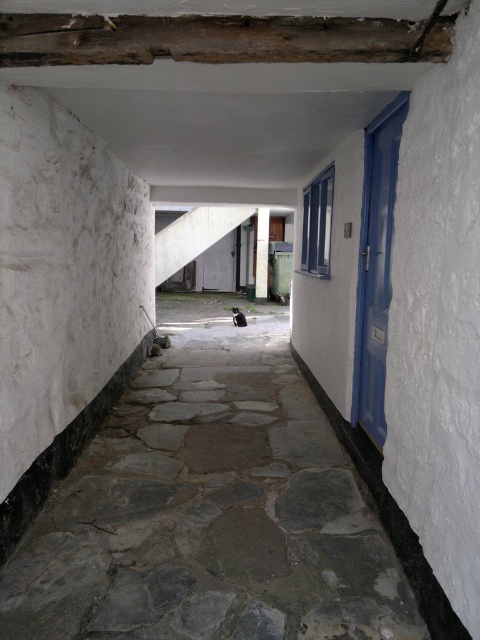
From the picture: Is wooden beam at upper center positioned at the back of blue painted wood door at right?

No, it is in front of blue painted wood door at right.

Does wooden beam at upper center appear over blue painted wood door at right?

Yes.

Who is more distant from viewer, [277,56] or [391,234]?

Point [391,234]

Where is `wooden beam at upper center`? wooden beam at upper center is located at coordinates (217, 38).

Between gray stone path at center and white painted wood pillar at center, which one has less height?

With less height is gray stone path at center.

Where is `gray stone path at center`? This screenshot has height=640, width=480. gray stone path at center is located at coordinates (210, 509).

Is point (392, 224) closer to viewer compared to point (267, 257)?

Yes, it is.

Is blue painted wood door at right wider than white painted wood pillar at center?

No.

Does point (389, 170) come in front of point (259, 280)?

Yes, it is in front of point (259, 280).

You are a GUI agent. You are given a task and a screenshot of the screen. Output one action in this format:
    pyautogui.click(x=<x>, y=<y>)
    Task: Click on the blue painted wood door at right
    The image size is (480, 640).
    Given the screenshot: What is the action you would take?
    pyautogui.click(x=375, y=268)